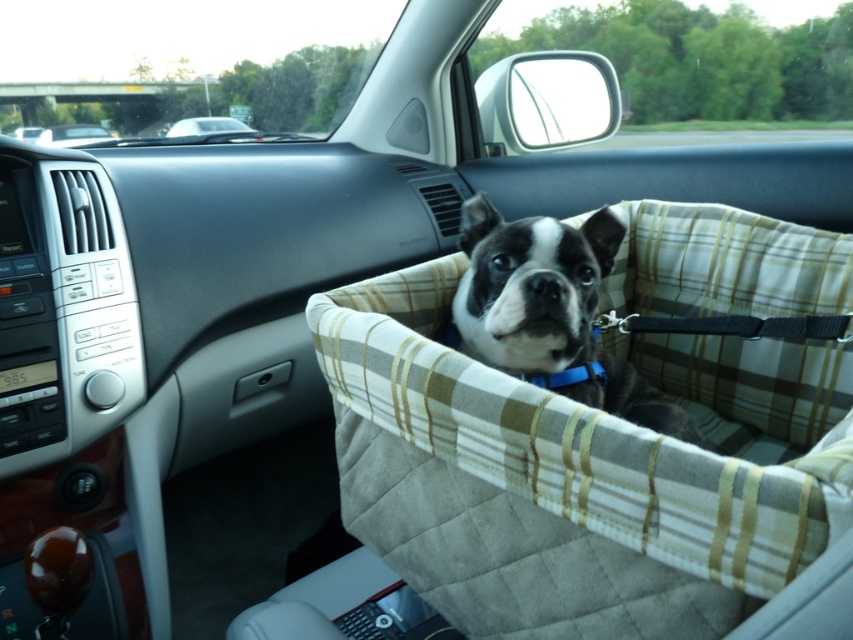
Question: Can you confirm if plaid fabric dog bed at center is thinner than white plastic car at upper center?

Choices:
 (A) yes
 (B) no

Answer: (B)

Question: Does black-and-white fur dog at center appear on the left side of white plastic car at upper center?

Choices:
 (A) yes
 (B) no

Answer: (B)

Question: Which object appears closest to the camera in this image?

Choices:
 (A) matte black car at upper left
 (B) white plastic car at upper center

Answer: (A)

Question: Which of these objects is positioned closest to the black-and-white fur dog at center?

Choices:
 (A) plaid fabric dog bed at center
 (B) matte black car at upper left
 (C) white plastic car at upper center

Answer: (A)

Question: Based on their relative distances, which object is nearer to the plaid fabric dog bed at center?

Choices:
 (A) white plastic car at upper center
 (B) black-and-white fur dog at center
 (C) matte black car at upper left

Answer: (B)

Question: Does black-and-white fur dog at center appear under white plastic car at upper center?

Choices:
 (A) yes
 (B) no

Answer: (A)